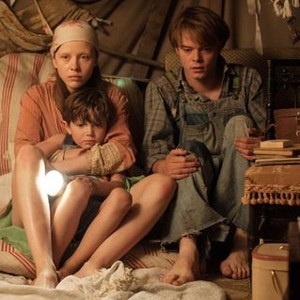
Find the location of `random tassels on the furniture cover`. random tassels on the furniture cover is located at coordinates (259, 202), (292, 198), (277, 200).